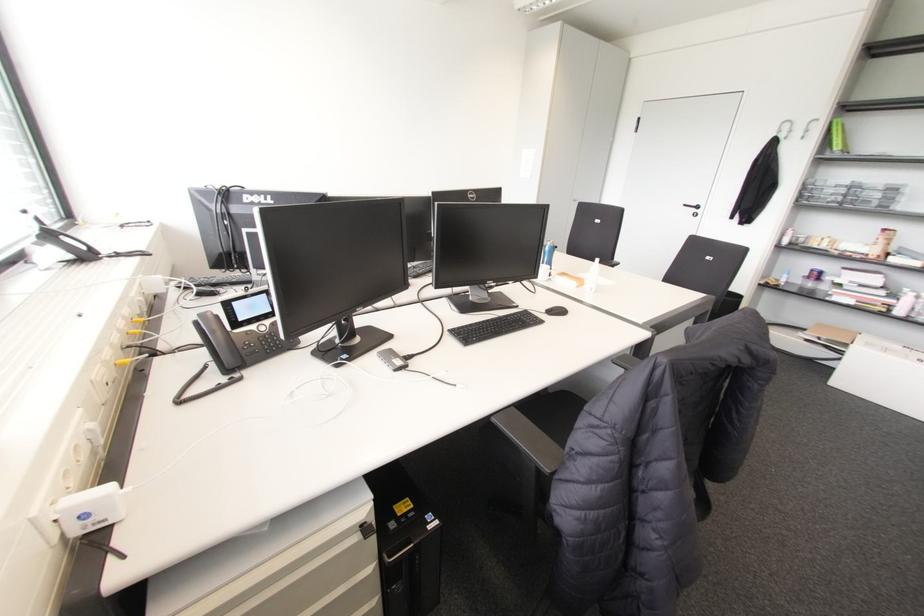
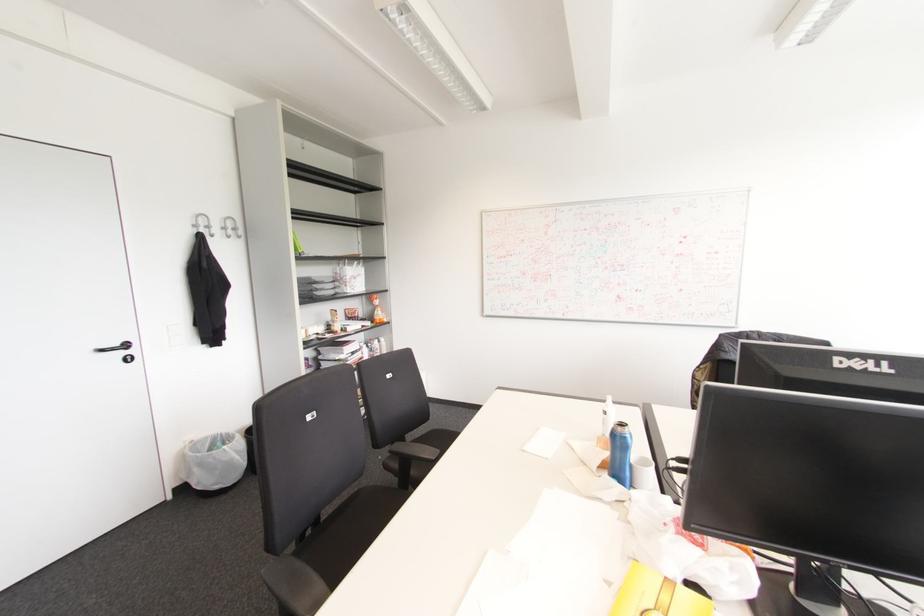
Where in the second image is the point corresponding to the point at 697,207 from the first image?

(126, 345)